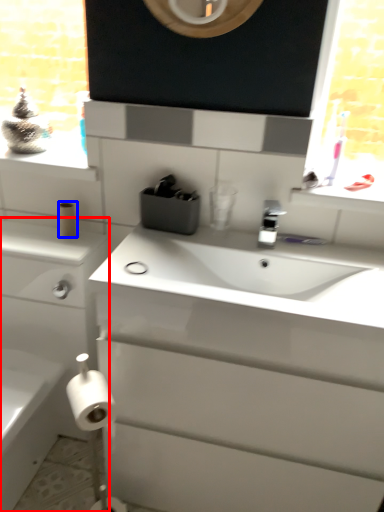
Question: Which of the following is the farthest to the observer, bathroom cabinet (highlighted by a red box) or toilet paper (highlighted by a blue box)?

Choices:
 (A) bathroom cabinet
 (B) toilet paper

Answer: (B)